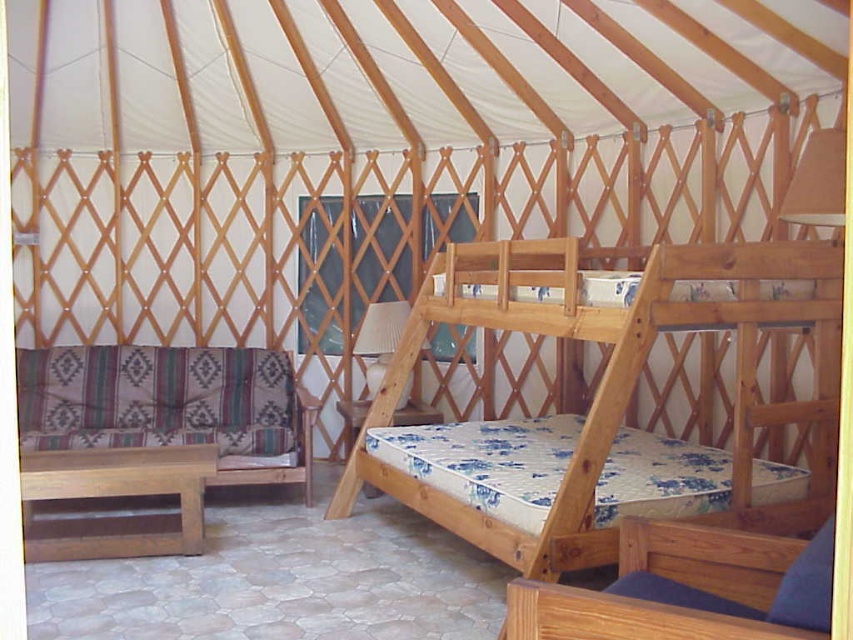
You are planning to move a large rectangular storage box into the yurt. The box is as wide as the striped fabric couch at lower left. Can you fit the box next to the natural wood bunk bed at center without rotating it?

The natural wood bunk bed at center is wider than the striped fabric couch at lower left. Since the box is as wide as the couch, it would be narrower than the bunk bed. However, the question is about fitting it next to the bed, not comparing their widths directly. The available space next to the bunk bed depends on the total width of the yurt and the bed. Since the scene description mentions the bunk bed is at the center and the couch is at the lower left, but there is no information about the yurt width or

You are standing inside the yurt and want to place a small decorative item on the natural wood bunk bed at center. The yurt has a limited space, so you need to ensure the item will fit. Can you confirm if the point at coordinates point (621,401) is on the natural wood bunk bed at center?

Yes, the point at coordinates point (621,401) is on the natural wood bunk bed at center, so placing the item there would be appropriate.